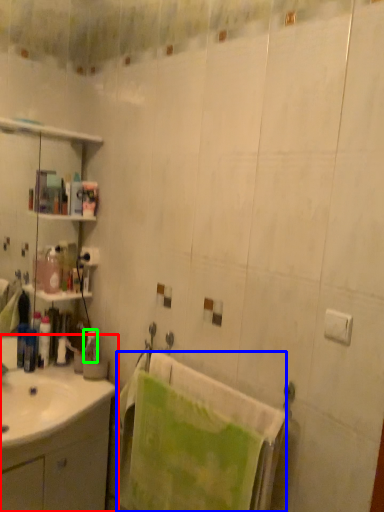
Question: Which object is the closest to the bathroom cabinet (highlighted by a red box)? Choose among these: beach towel (highlighted by a blue box) or toiletry (highlighted by a green box).

Choices:
 (A) beach towel
 (B) toiletry

Answer: (A)